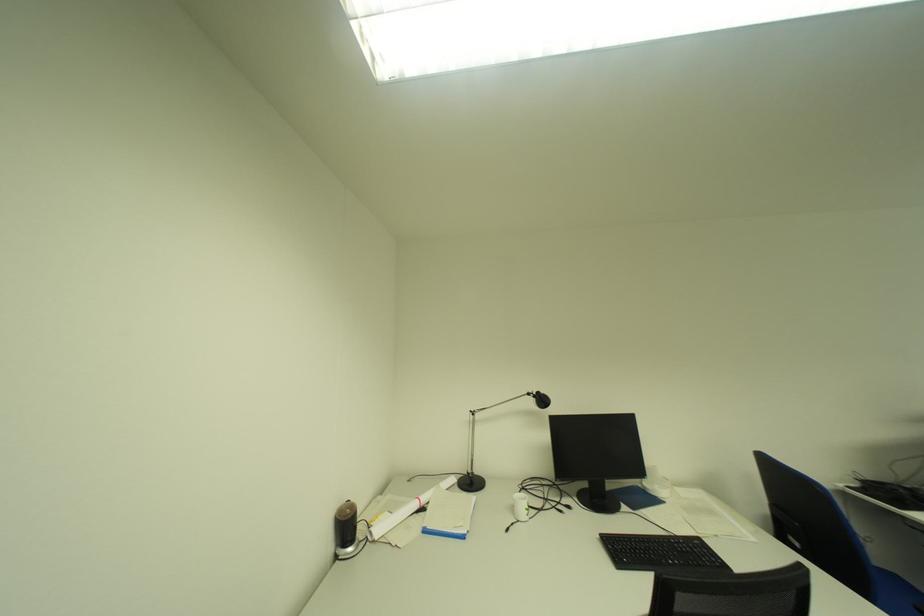
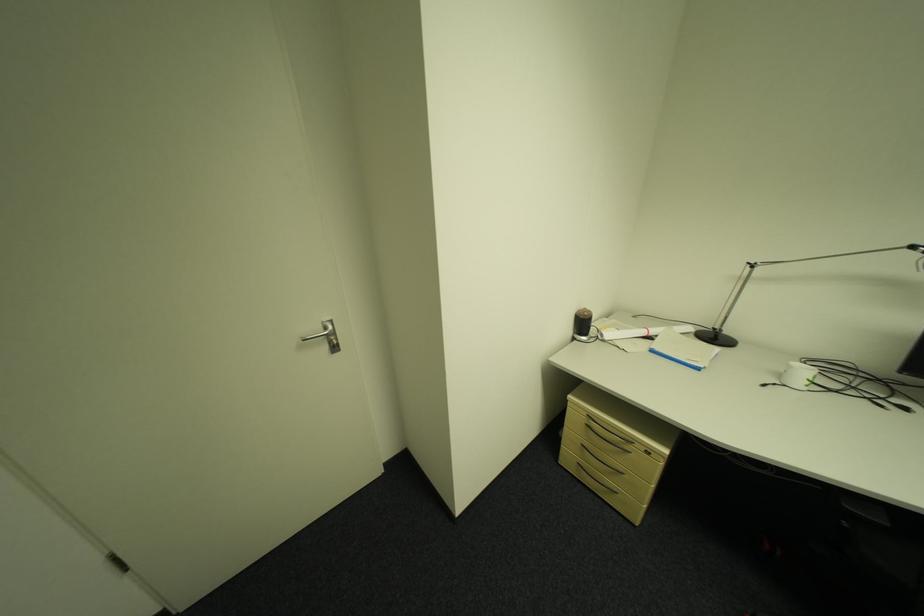
In the second image, find the point that corresponds to point 523,525 in the first image.

(784, 386)